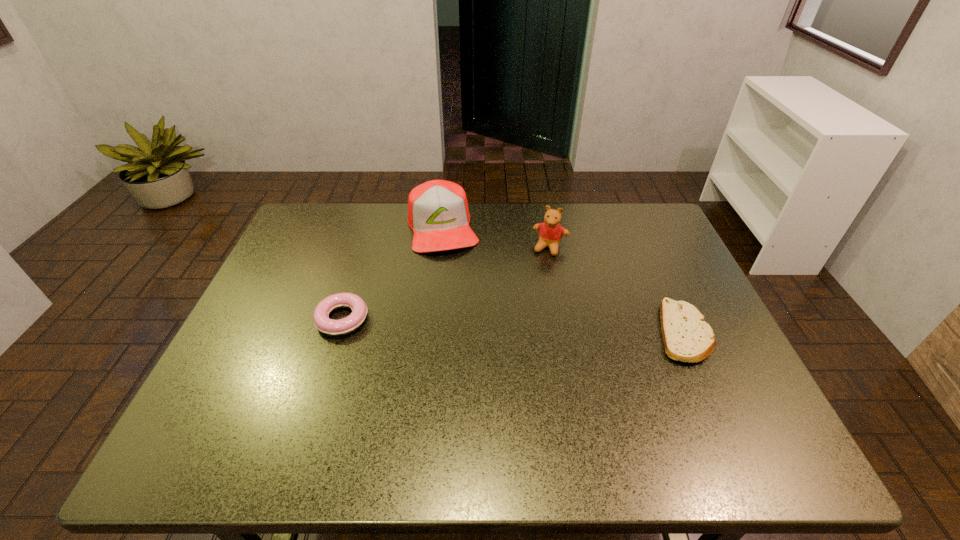
Where is `vacant region located on the front-facing side of the third object from right to left`? This screenshot has height=540, width=960. vacant region located on the front-facing side of the third object from right to left is located at coordinates (457, 287).

This screenshot has width=960, height=540. What are the coordinates of `free space located on the front-facing side of the second object from right to left` in the screenshot? It's located at (533, 293).

Locate an element on the screen. The width and height of the screenshot is (960, 540). vacant space located 0.260m on the front-facing side of the second object from right to left is located at coordinates (523, 319).

The width and height of the screenshot is (960, 540). I want to click on free space located on the front-facing side of the second object from right to left, so click(x=535, y=288).

In order to click on baseball cap that is at the far edge in this screenshot , I will do pyautogui.click(x=438, y=213).

You are a GUI agent. You are given a task and a screenshot of the screen. Output one action in this format:
    pyautogui.click(x=<x>, y=<y>)
    Task: Click on the teddy bear located in the far edge section of the desktop
    The width and height of the screenshot is (960, 540).
    Given the screenshot: What is the action you would take?
    pyautogui.click(x=550, y=232)

At what (x,y) coordinates should I click in order to perform the action: click on object at the right edge. Please return your answer as a coordinate pair (x, y). The image size is (960, 540). Looking at the image, I should click on (687, 337).

Where is `vacant space at the near edge`? The image size is (960, 540). vacant space at the near edge is located at coordinates (608, 402).

You are a GUI agent. You are given a task and a screenshot of the screen. Output one action in this format:
    pyautogui.click(x=<x>, y=<y>)
    Task: Click on the free spot at the left edge of the desktop
    Image resolution: width=960 pixels, height=540 pixels.
    Given the screenshot: What is the action you would take?
    pyautogui.click(x=269, y=313)

The height and width of the screenshot is (540, 960). I want to click on vacant space at the right edge of the desktop, so click(676, 263).